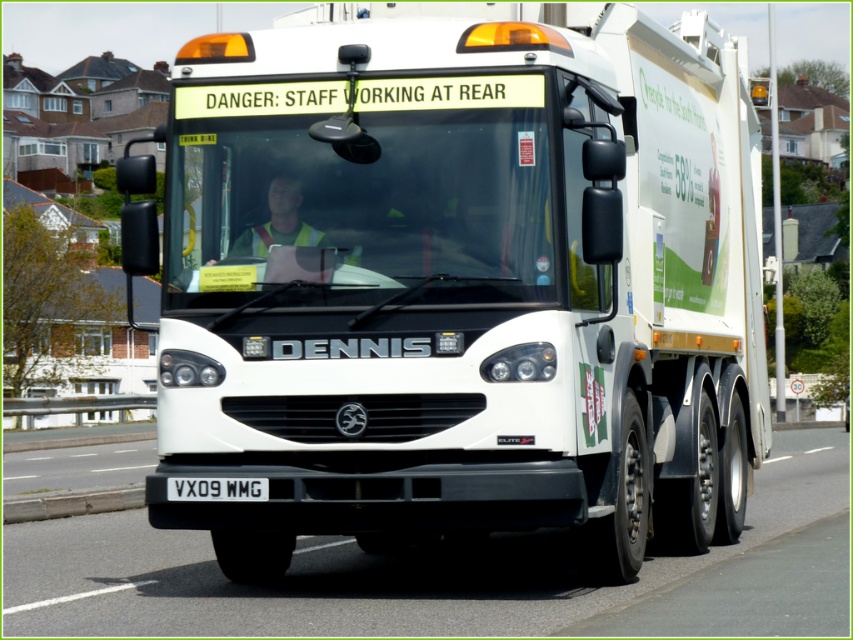
Who is higher up, white matte truck at center or gray concrete curb at lower left?

white matte truck at center is above.

Is point (445, 529) positioned after point (15, 509)?

That is False.

Identify the location of white matte truck at center. Image resolution: width=853 pixels, height=640 pixels. (462, 285).

Is gray concrete curb at lower left above black metal/license plate at center?

No.

In the scene shown: Who is more forward, [44,513] or [193,483]?

Positioned in front is point [193,483].

This screenshot has width=853, height=640. I want to click on gray concrete curb at lower left, so click(71, 502).

Between point (412, 225) and point (256, 497), which one is positioned behind?

The point (412, 225) is more distant.

Is white matte truck at center to the right of black metal/license plate at center from the viewer's perspective?

Correct, you'll find white matte truck at center to the right of black metal/license plate at center.

The image size is (853, 640). In order to click on white matte truck at center in this screenshot , I will do `click(462, 285)`.